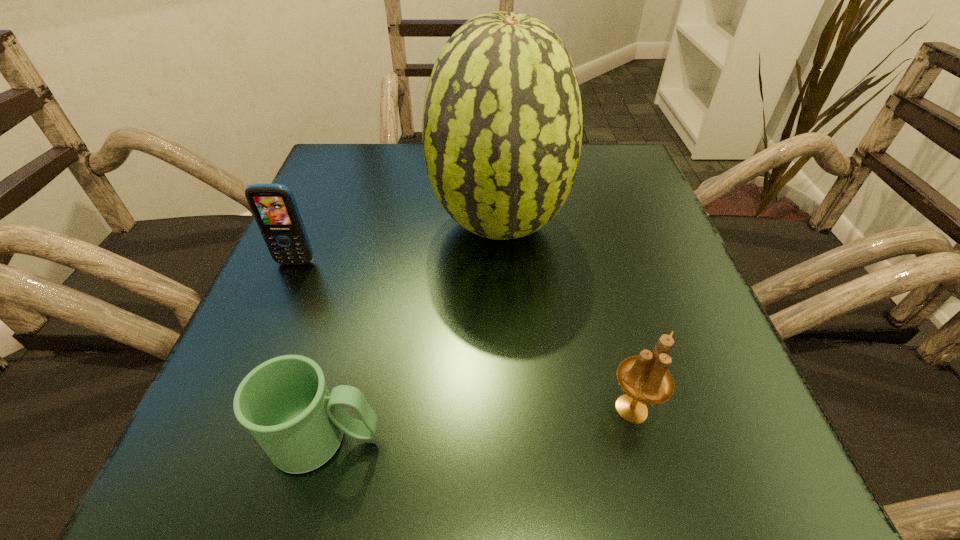
Find the location of `the tallest object`. the tallest object is located at coordinates (502, 126).

The width and height of the screenshot is (960, 540). I want to click on cellular telephone, so click(274, 207).

Locate an element on the screen. candle holder is located at coordinates (645, 379).

Where is `the shortest object`? the shortest object is located at coordinates (284, 402).

Identify the location of the third object from right to left. This screenshot has width=960, height=540. (284, 402).

What are the coordinates of `blank space located 0.120m on the back of the tallest object` in the screenshot? It's located at [x=495, y=157].

At what (x,y) coordinates should I click in order to perform the action: click on vacant region located 0.100m on the screen of the cellular telephone. Please return your answer as a coordinate pair (x, y). This screenshot has width=960, height=540. Looking at the image, I should click on (276, 310).

Where is `vacant space located on the left of the candle holder`? The image size is (960, 540). vacant space located on the left of the candle holder is located at coordinates (305, 409).

The width and height of the screenshot is (960, 540). Find the location of `free space located on the side of the shortest object with the handle`. free space located on the side of the shortest object with the handle is located at coordinates (420, 439).

You are a GUI agent. You are given a task and a screenshot of the screen. Output one action in this format:
    pyautogui.click(x=<x>, y=<y>)
    Task: Click on the object that is at the far edge
    
    Given the screenshot: What is the action you would take?
    pyautogui.click(x=502, y=126)